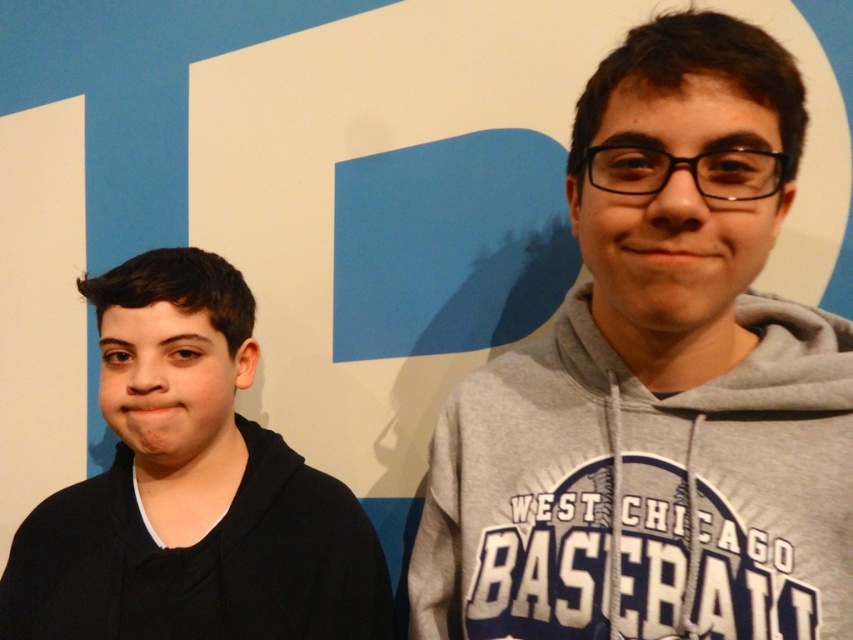
Is gray hoodie at center closer to camera compared to black matte hoodie at left?

Yes.

Can you confirm if gray hoodie at center is smaller than black matte hoodie at left?

Incorrect, gray hoodie at center is not smaller in size than black matte hoodie at left.

At what (x,y) coordinates should I click in order to perform the action: click on gray hoodie at center. Please return your answer as a coordinate pair (x, y). The height and width of the screenshot is (640, 853). Looking at the image, I should click on (656, 387).